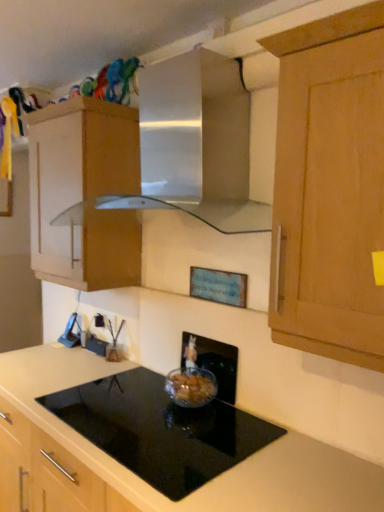
Identify the location of clear glass bowl at center. (216, 362).

Describe the element at coordinates (100, 321) in the screenshot. Image resolution: width=384 pixels, height=512 pixels. I see `black plastic electric outlet at lower left` at that location.

The width and height of the screenshot is (384, 512). What do you see at coordinates (211, 481) in the screenshot?
I see `black glass cooktop at center` at bounding box center [211, 481].

What do you see at coordinates (192, 146) in the screenshot? This screenshot has width=384, height=512. I see `satin silver vent at upper center` at bounding box center [192, 146].

Locate an element on the screen. This screenshot has height=512, width=384. wooden cabinet at upper left is located at coordinates [x=84, y=193].

Considering the points (128, 132) and (100, 324), which point is behind, point (128, 132) or point (100, 324)?

The point (100, 324) is more distant.

Based on the photo, from a real-world perspective, is wooden cabinet at upper left over black plastic electric outlet at lower left?

Yes, from a real-world perspective, wooden cabinet at upper left is above black plastic electric outlet at lower left.

Between wooden cabinet at upper left and black plastic electric outlet at lower left, which one appears on the left side from the viewer's perspective?

wooden cabinet at upper left.

From the image's perspective, is wooden cabinet at upper left located above black plastic electric outlet at lower left?

Yes, from the image's perspective, wooden cabinet at upper left is on top of black plastic electric outlet at lower left.

From a real-world perspective, is black glass cooktop at center above or below black plastic electric outlet at lower left?

black glass cooktop at center is below black plastic electric outlet at lower left.

Between black glass cooktop at center and black plastic electric outlet at lower left, which one has larger width?

With larger width is black glass cooktop at center.

This screenshot has width=384, height=512. In order to click on countertop that is in front of the black plastic electric outlet at lower left in this screenshot , I will do `click(211, 481)`.

Can black plastic electric outlet at lower left be found inside black glass cooktop at center?

Actually, black plastic electric outlet at lower left is outside black glass cooktop at center.

Is satin silver vent at upper center surrounded by black plastic electric outlet at lower left?

No, satin silver vent at upper center is not inside black plastic electric outlet at lower left.

Is black plastic electric outlet at lower left turned away from satin silver vent at upper center?

No, black plastic electric outlet at lower left is not facing the opposite direction of satin silver vent at upper center.

Considering the sizes of objects black plastic electric outlet at lower left and satin silver vent at upper center in the image provided, who is bigger, black plastic electric outlet at lower left or satin silver vent at upper center?

Bigger between the two is satin silver vent at upper center.

Is point (211, 72) closer or farther from the camera than point (96, 326)?

Point (211, 72) is positioned closer to the camera compared to point (96, 326).

Is satin silver vent at upper center bigger than black plastic electric outlet at lower left?

Yes, satin silver vent at upper center is bigger than black plastic electric outlet at lower left.

Identify the location of electric outlet that appears on the left of satin silver vent at upper center. (100, 321).

Which is behind, satin silver vent at upper center or black plastic electric outlet at lower left?

black plastic electric outlet at lower left is further away from the camera.

How many degrees apart are the facing directions of black glass cooktop at center and clear glass bowl at center?

0.478 degrees.

Considering the sizes of black glass cooktop at center and clear glass bowl at center in the image, is black glass cooktop at center wider or thinner than clear glass bowl at center?

In the image, black glass cooktop at center appears to be wider than clear glass bowl at center.

Is black glass cooktop at center far from clear glass bowl at center?

No, black glass cooktop at center is in close proximity to clear glass bowl at center.

From their relative heights in the image, would you say black glass cooktop at center is taller or shorter than clear glass bowl at center?

In the image, black glass cooktop at center appears to be shorter than clear glass bowl at center.

How distant is black glass cooktop at center from wooden cabinet at upper left?

A distance of 29.94 inches exists between black glass cooktop at center and wooden cabinet at upper left.

Which is correct: black glass cooktop at center is inside wooden cabinet at upper left, or outside of it?

black glass cooktop at center is not enclosed by wooden cabinet at upper left.

At what (x,y) coordinates should I click in order to perform the action: click on cabinetry above the black glass cooktop at center (from a real-world perspective). Please return your answer as a coordinate pair (x, y). Looking at the image, I should click on (84, 193).

From the image's perspective, is black glass cooktop at center positioned above or below wooden cabinet at upper left?

black glass cooktop at center is situated lower than wooden cabinet at upper left in the image.

Which is closer, (103, 318) or (118, 230)?

The point (118, 230) is closer.

Is black plastic electric outlet at lower left oriented away from wooden cabinet at upper left?

No, black plastic electric outlet at lower left is not facing the opposite direction of wooden cabinet at upper left.

Between black plastic electric outlet at lower left and wooden cabinet at upper left, which one has smaller width?

black plastic electric outlet at lower left is thinner.

This screenshot has height=512, width=384. Identify the location of cabinetry lying in front of the black plastic electric outlet at lower left. (84, 193).

Identify the location of electric outlet on the left of black glass cooktop at center. The width and height of the screenshot is (384, 512). (100, 321).

From the image, which object appears to be nearer to clear glass bowl at center, black plastic electric outlet at lower left or satin silver vent at upper center?

satin silver vent at upper center is positioned closer to the anchor clear glass bowl at center.

Which object lies nearer to the anchor point black glass cooktop at center, wooden cabinet at upper left or clear glass bowl at center?

clear glass bowl at center lies closer to black glass cooktop at center than the other object.

In the scene shown: Which object lies further to the anchor point wooden cabinet at upper left, clear glass bowl at center or black plastic electric outlet at lower left?

Among the two, clear glass bowl at center is located further to wooden cabinet at upper left.

Based on their spatial positions, is wooden cabinet at upper left or black glass cooktop at center closer to black plastic electric outlet at lower left?

The object closer to black plastic electric outlet at lower left is wooden cabinet at upper left.

Based on their spatial positions, is wooden cabinet at upper left or satin silver vent at upper center closer to black plastic electric outlet at lower left?

wooden cabinet at upper left.

Looking at the image, which one is located further to wooden cabinet at upper left, black glass cooktop at center or satin silver vent at upper center?

The object further to wooden cabinet at upper left is black glass cooktop at center.

Considering their positions, is clear glass bowl at center positioned further to black plastic electric outlet at lower left than wooden cabinet at upper left?

clear glass bowl at center is positioned further to the anchor black plastic electric outlet at lower left.

Which object lies nearer to the anchor point satin silver vent at upper center, wooden cabinet at upper left or black plastic electric outlet at lower left?

The object closer to satin silver vent at upper center is wooden cabinet at upper left.

Identify the location of countertop between satin silver vent at upper center and black plastic electric outlet at lower left along the z-axis. (211, 481).

Where is `appliance between wooden cabinet at upper left and black glass cooktop at center vertically`? This screenshot has width=384, height=512. appliance between wooden cabinet at upper left and black glass cooktop at center vertically is located at coordinates (216, 362).

Identify the location of appliance between satin silver vent at upper center and black glass cooktop at center vertically. (216, 362).

Identify the location of appliance located between black glass cooktop at center and black plastic electric outlet at lower left in the depth direction. The image size is (384, 512). (216, 362).